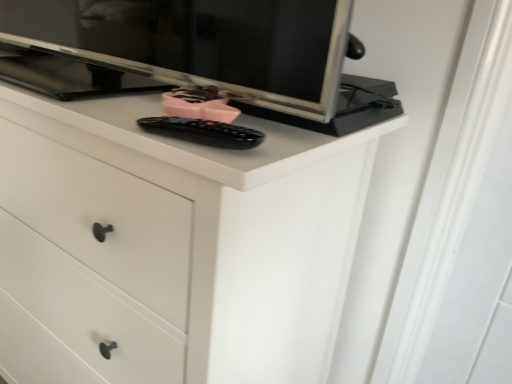
Question: Looking at the image, does white matte chest of drawers at center seem bigger or smaller compared to black plastic remote at center?

Choices:
 (A) small
 (B) big

Answer: (B)

Question: Visually, is white matte chest of drawers at center positioned to the left or to the right of black plastic remote at center?

Choices:
 (A) right
 (B) left

Answer: (B)

Question: In terms of height, does white matte chest of drawers at center look taller or shorter compared to black plastic remote at center?

Choices:
 (A) tall
 (B) short

Answer: (A)

Question: In terms of width, does black plastic remote at center look wider or thinner when compared to white matte chest of drawers at center?

Choices:
 (A) wide
 (B) thin

Answer: (B)

Question: Is point coord(216,139) positioned closer to the camera than point coord(322,173)?

Choices:
 (A) closer
 (B) farther

Answer: (A)

Question: From their relative heights in the image, would you say black plastic remote at center is taller or shorter than white matte chest of drawers at center?

Choices:
 (A) tall
 (B) short

Answer: (B)

Question: Choose the correct answer: Is black plastic remote at center inside white matte chest of drawers at center or outside it?

Choices:
 (A) outside
 (B) inside

Answer: (B)